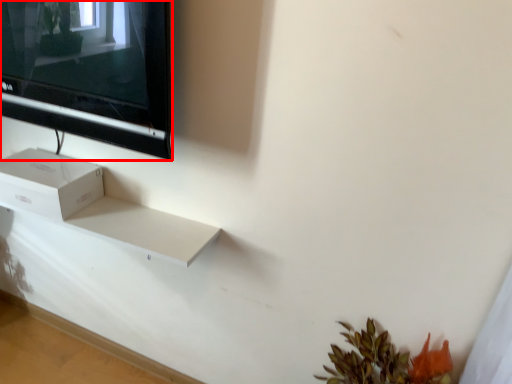
Question: From the image's perspective, where is television (annotated by the red box) located in relation to box in the image?

Choices:
 (A) above
 (B) below

Answer: (A)